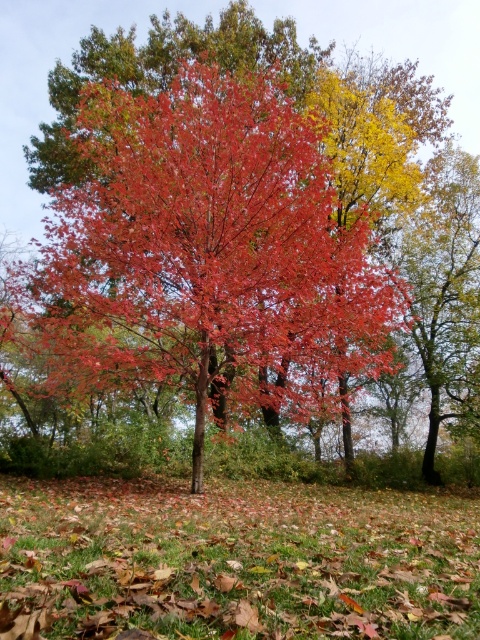
Is shiny red maple tree at center thinner than brown grass at lower center?

No, shiny red maple tree at center is not thinner than brown grass at lower center.

The height and width of the screenshot is (640, 480). Identify the location of shiny red maple tree at center. (210, 257).